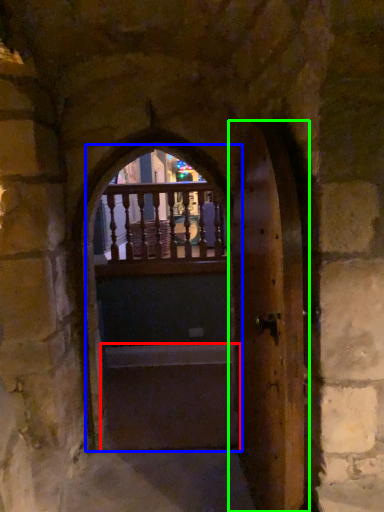
Question: Estimate the real-world distances between objects in this image. Which object is closer to stairwell (highlighted by a red box), door (highlighted by a blue box) or door (highlighted by a green box)?

Choices:
 (A) door
 (B) door

Answer: (A)